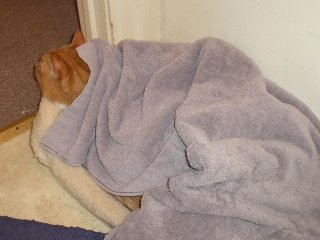
The image size is (320, 240). Identify the location of board. (22, 128).